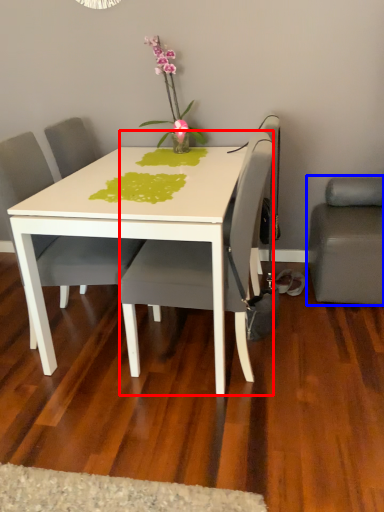
Question: Among these objects, which one is nearest to the camera, chair (highlighted by a red box) or studio couch (highlighted by a blue box)?

Choices:
 (A) chair
 (B) studio couch

Answer: (A)